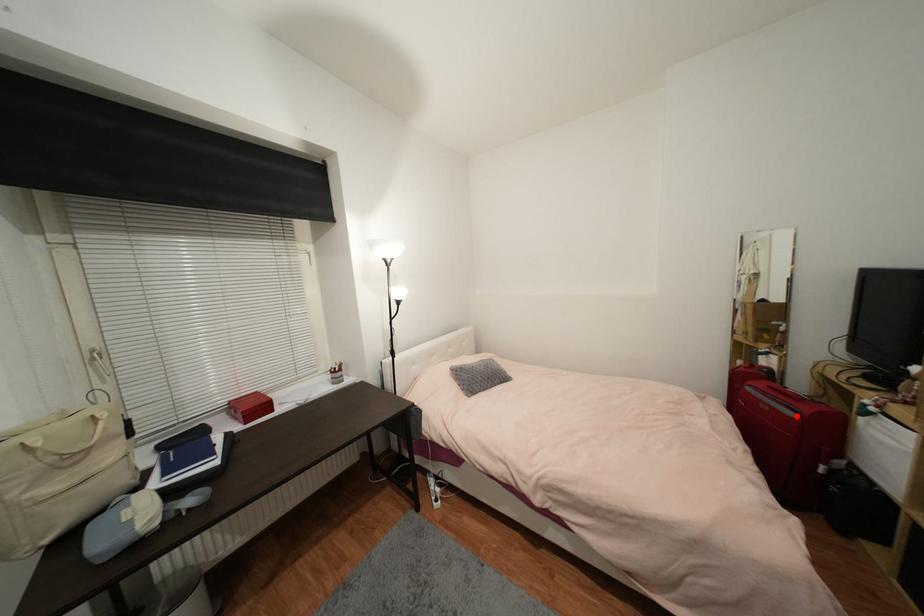
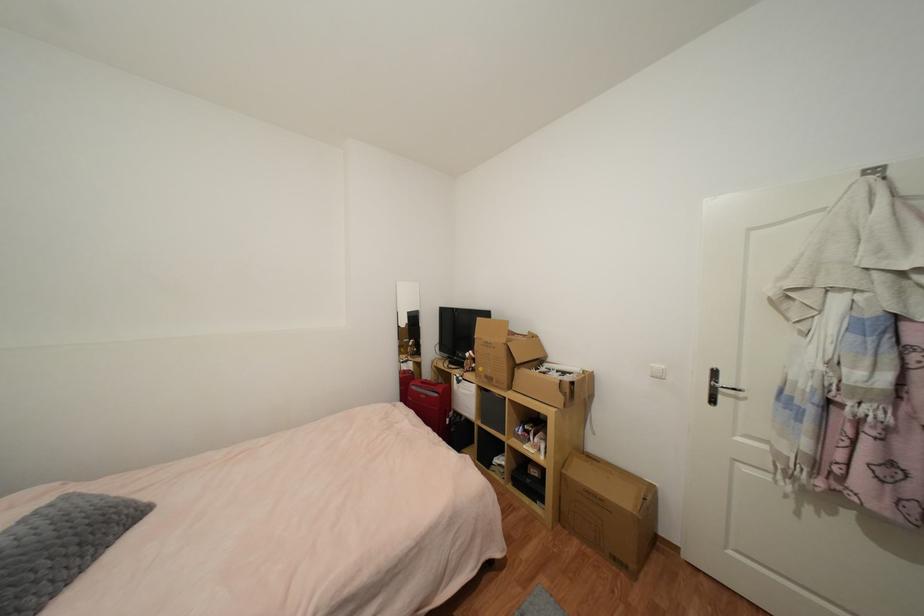
Find the pixel in the second image that matches the highlighted location in the first image.

(440, 397)